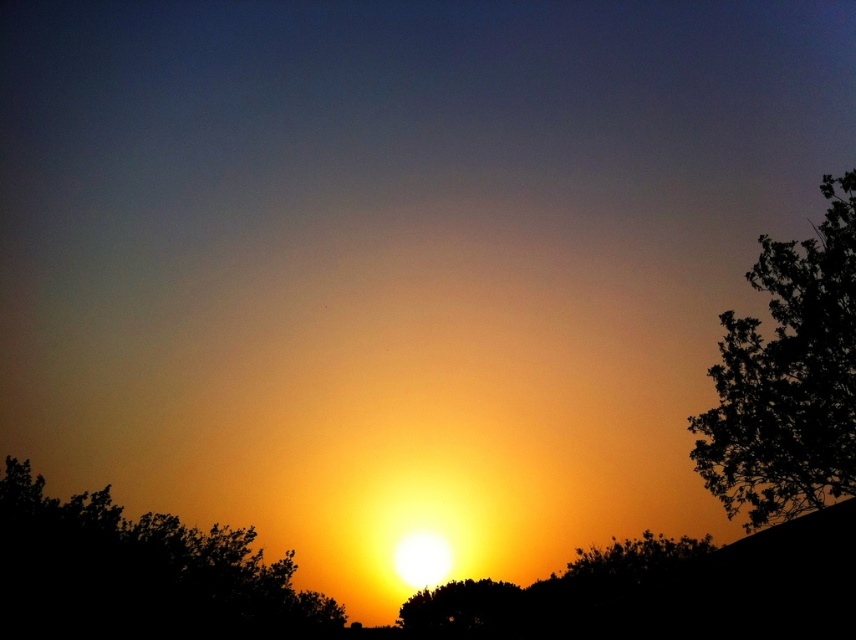
Question: Estimate the real-world distances between objects in this image. Which object is farther from the dark green leafy tree at right?

Choices:
 (A) silhouette leafy tree at lower right
 (B) green leafy tree at center

Answer: (B)

Question: From the image, what is the correct spatial relationship of dark green leafy tree at right in relation to green leafy tree at center?

Choices:
 (A) left
 (B) right

Answer: (B)

Question: Which object is the closest to the green leafy tree at center?

Choices:
 (A) dark green leafy tree at right
 (B) silhouette leafy tree at center
 (C) silhouette leafy tree at lower right

Answer: (C)

Question: Does silhouette leafy tree at center have a greater width compared to silhouette leafy tree at lower right?

Choices:
 (A) no
 (B) yes

Answer: (B)

Question: Is dark green leafy tree at right below green leafy tree at center?

Choices:
 (A) no
 (B) yes

Answer: (A)

Question: Among these objects, which one is nearest to the camera?

Choices:
 (A) green leafy tree at center
 (B) dark green leafy tree at right

Answer: (B)